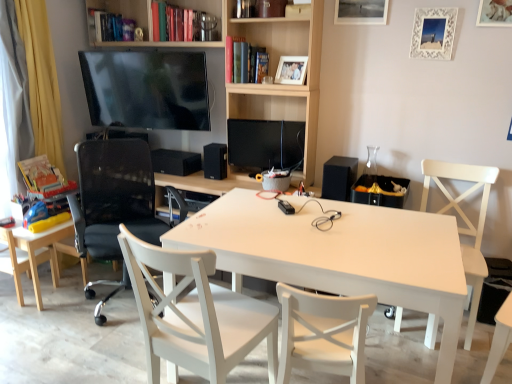
Question: Is point (297, 59) closer or farther from the camera than point (254, 306)?

Choices:
 (A) closer
 (B) farther

Answer: (B)

Question: Looking at the image, does wooden photo frame at upper center, marked as the first picture frame in a left-to-right arrangement, seem bigger or smaller compared to white wood chair at center, the 2th chair when ordered from right to left?

Choices:
 (A) big
 (B) small

Answer: (B)

Question: Estimate the real-world distances between objects in this image. Which object is closer to the black matte speaker at center, marked as the 2th speaker in a front-to-back arrangement?

Choices:
 (A) white wood chair at center, the third chair from the left
 (B) matte black tv at upper center
 (C) white matte table at center
 (D) hardcover book at left, placed as the third book when sorted from right to left
 (E) wooden picture frame at upper right, marked as the 4th picture frame in a left-to-right arrangement

Answer: (B)

Question: Estimate the real-world distances between objects in this image. Which object is farther from the white wood chair at center, the 2th chair when ordered from right to left?

Choices:
 (A) metallic silver picture frame at upper center, which appears as the third picture frame when viewed from the right
 (B) hardcover book at upper left, positioned as the second book in left-to-right order
 (C) black mesh office chair at left, placed as the third chair when sorted from right to left
 (D) white textured picture frame at upper right, the 2th picture frame when ordered from right to left
 (E) white wood chair at right, which is the 4th chair from left to right

Answer: (B)